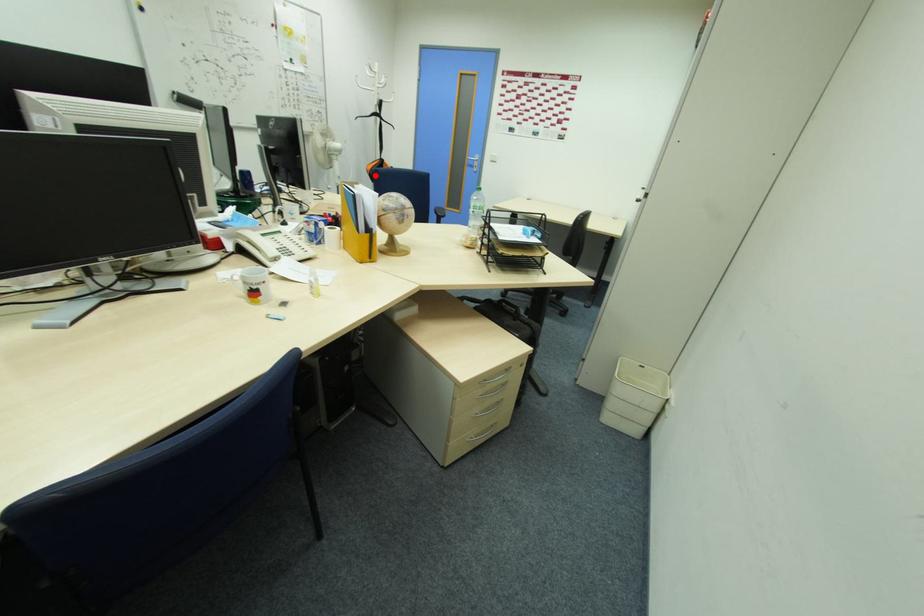
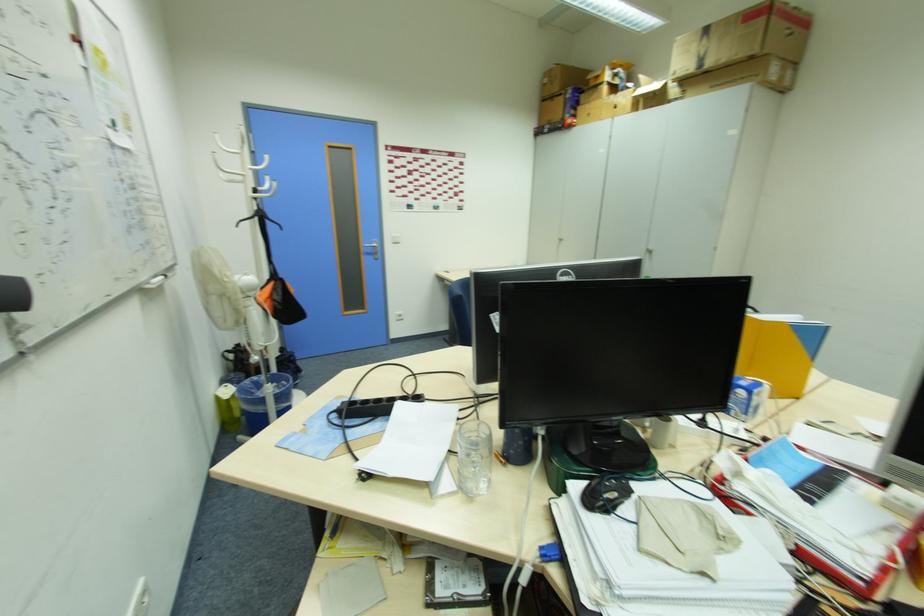
Question: A red point is marked in image1. In image2, is the corresponding 3D point closer to the camera or farther? Reply with the corresponding letter.

Choices:
 (A) The corresponding 3D point is closer.
 (B) The corresponding 3D point is farther.

Answer: (A)